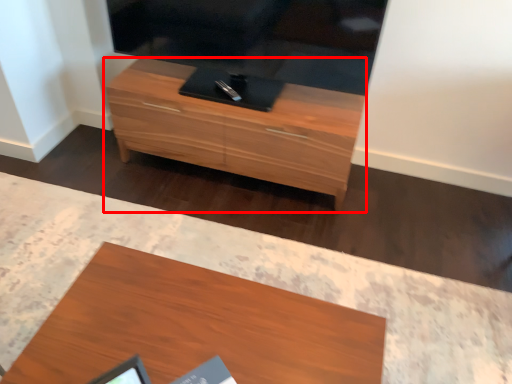
Question: Observing the image, what is the correct spatial positioning of chest of drawers (annotated by the red box) in reference to desk?

Choices:
 (A) right
 (B) left

Answer: (A)